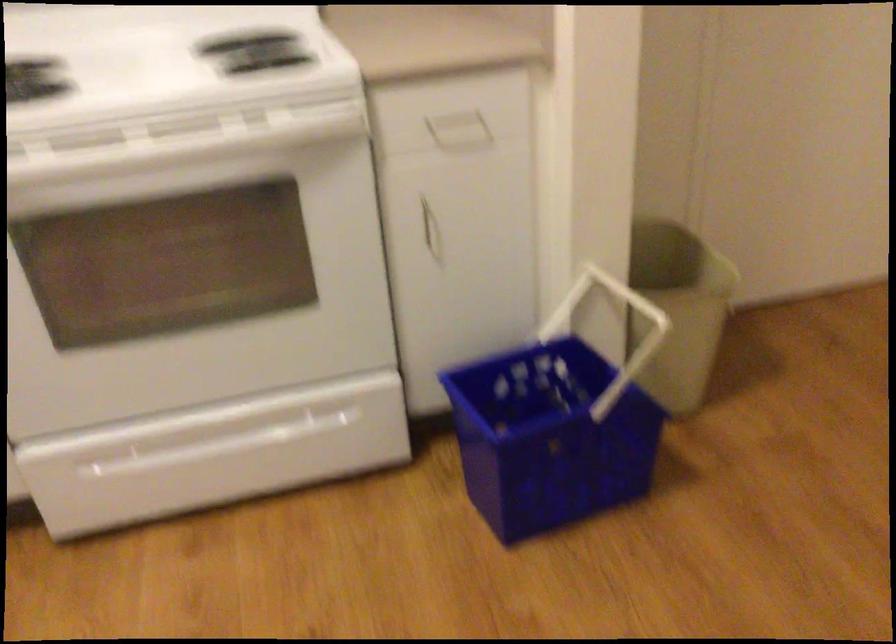
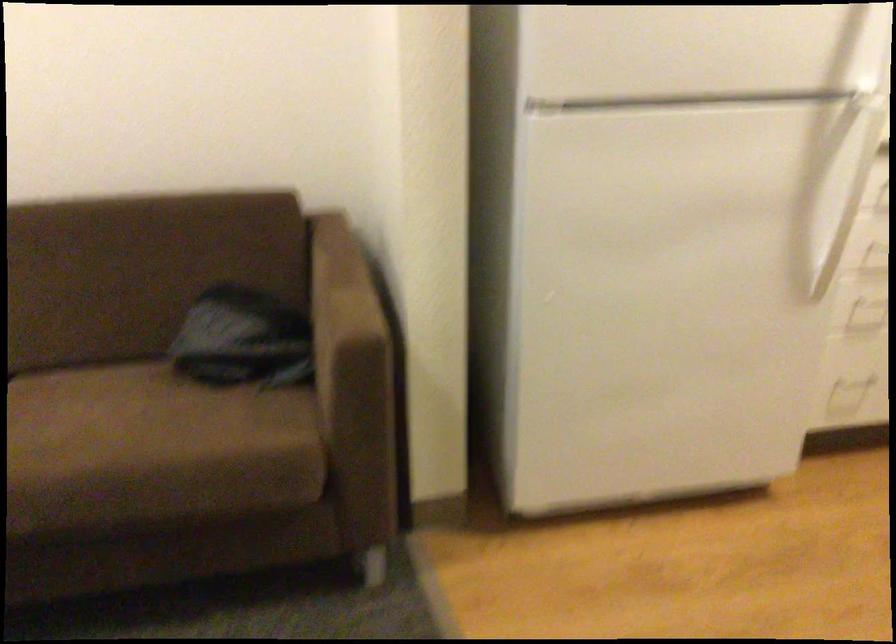
First-person continuous shooting, in which direction is the camera rotating?

The rotation direction of the camera is left-down.